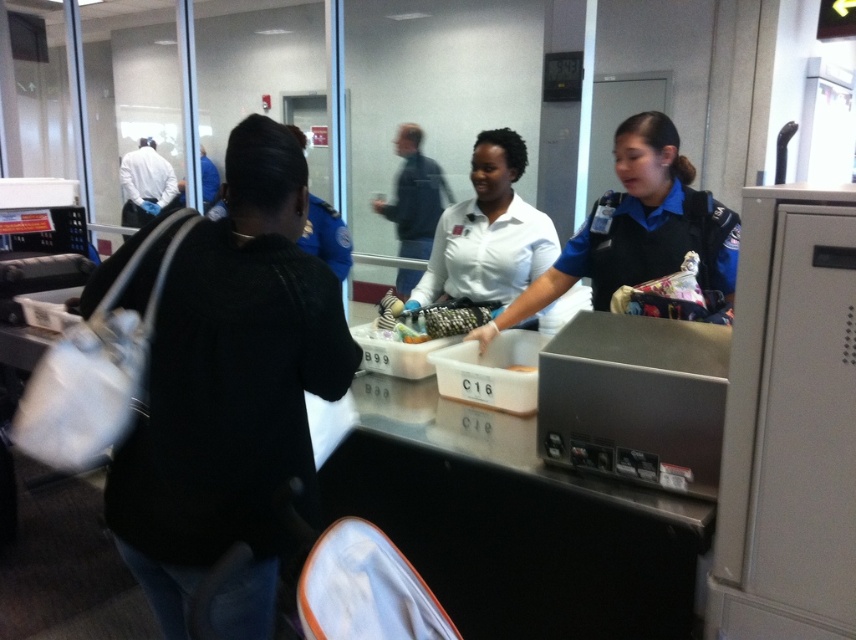
Can you confirm if blue uniform at center is positioned to the left of white matte uniform at center?

In fact, blue uniform at center is to the right of white matte uniform at center.

Which is more to the right, blue uniform at center or white matte uniform at center?

blue uniform at center is more to the right.

Is point (473, 337) closer to camera compared to point (391, 307)?

Yes, it is in front of point (391, 307).

The height and width of the screenshot is (640, 856). In order to click on blue uniform at center in this screenshot , I will do `click(637, 228)`.

Is black sweater at center positioned before brown crumbly bread at center?

Yes, it is in front of brown crumbly bread at center.

Which is above, black sweater at center or brown crumbly bread at center?

black sweater at center

Between point (203, 280) and point (522, 369), which one is positioned in front?

Point (203, 280) is in front.

Find the location of a particular element. The image size is (856, 640). black sweater at center is located at coordinates (232, 397).

Is black sweater at center to the left of blue uniform at center from the viewer's perspective?

Correct, you'll find black sweater at center to the left of blue uniform at center.

From the picture: Who is lower down, black sweater at center or blue uniform at center?

Positioned lower is black sweater at center.

At what (x,y) coordinates should I click in order to perform the action: click on black sweater at center. Please return your answer as a coordinate pair (x, y). The image size is (856, 640). Looking at the image, I should click on (232, 397).